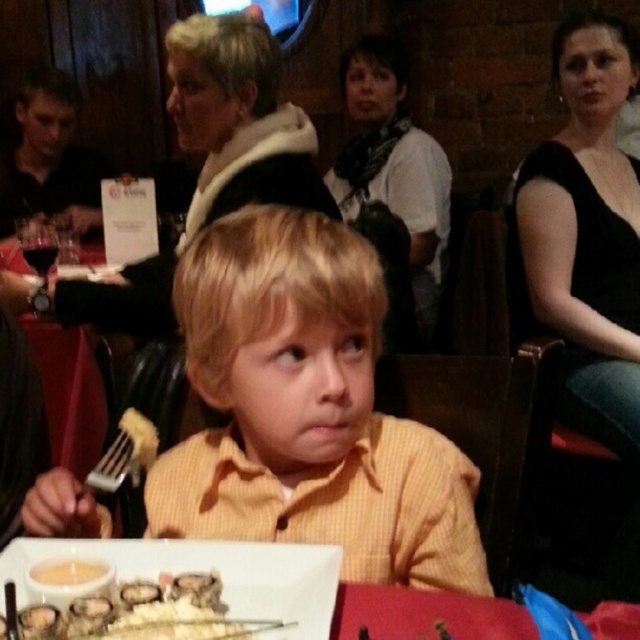
Question: Which is farther from the yellow cheese at lower left?

Choices:
 (A) yellow striped shirt at center
 (B) white ceramic plate at lower center

Answer: (A)

Question: Observing the image, what is the correct spatial positioning of yellow striped shirt at center in reference to yellow cheese at lower left?

Choices:
 (A) right
 (B) left

Answer: (A)

Question: Which of the following is the closest to the observer?

Choices:
 (A) (42, 566)
 (B) (221, 250)
 (C) (225, 572)

Answer: (A)

Question: Is yellow striped shirt at center bigger than yellow cheese at lower left?

Choices:
 (A) no
 (B) yes

Answer: (B)

Question: Among these points, which one is farthest from the camera?

Choices:
 (A) (61, 570)
 (B) (332, 576)

Answer: (B)

Question: Does white ceramic plate at lower center appear on the left side of yellow cheese at lower left?

Choices:
 (A) no
 (B) yes

Answer: (A)